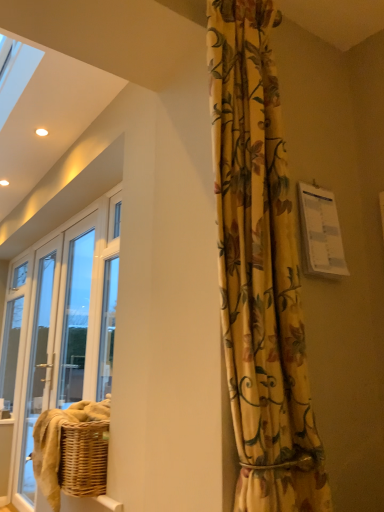
Question: Does clear glass screen door at left have a greater width compared to floral yellow curtain at center?

Choices:
 (A) yes
 (B) no

Answer: (B)

Question: From the image's perspective, would you say clear glass screen door at left is shown under floral yellow curtain at center?

Choices:
 (A) no
 (B) yes

Answer: (B)

Question: From a real-world perspective, is clear glass screen door at left on floral yellow curtain at center?

Choices:
 (A) yes
 (B) no

Answer: (B)

Question: Can you confirm if clear glass screen door at left is shorter than floral yellow curtain at center?

Choices:
 (A) yes
 (B) no

Answer: (B)

Question: Is clear glass screen door at left with floral yellow curtain at center?

Choices:
 (A) no
 (B) yes

Answer: (A)

Question: From a real-world perspective, does clear glass screen door at left sit lower than floral yellow curtain at center?

Choices:
 (A) no
 (B) yes

Answer: (B)

Question: Is there a large distance between floral yellow curtain at center and clear glass screen door at left?

Choices:
 (A) yes
 (B) no

Answer: (A)

Question: Is floral yellow curtain at center wider than clear glass screen door at left?

Choices:
 (A) yes
 (B) no

Answer: (A)

Question: Is floral yellow curtain at center thinner than clear glass screen door at left?

Choices:
 (A) no
 (B) yes

Answer: (A)

Question: Does floral yellow curtain at center turn towards clear glass screen door at left?

Choices:
 (A) yes
 (B) no

Answer: (B)

Question: Considering the relative positions of floral yellow curtain at center and clear glass screen door at left in the image provided, is floral yellow curtain at center to the right of clear glass screen door at left from the viewer's perspective?

Choices:
 (A) yes
 (B) no

Answer: (A)

Question: Could clear glass screen door at left be considered to be inside floral yellow curtain at center?

Choices:
 (A) no
 (B) yes

Answer: (A)

Question: In the image, is floral yellow curtain at center positioned in front of or behind clear glass screen door at left?

Choices:
 (A) front
 (B) behind

Answer: (A)